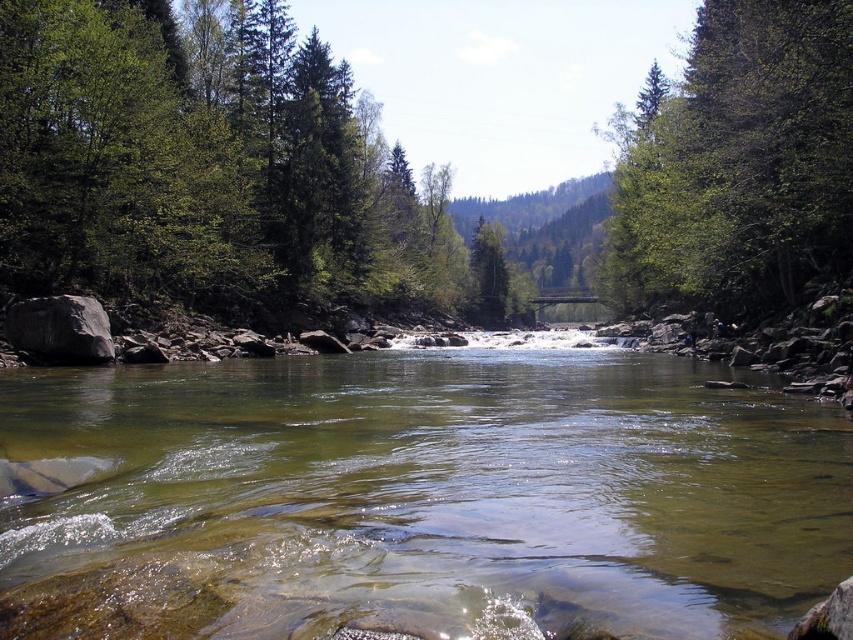
You are standing at a viewpoint overlooking the river and want to take a photo. You notice two points marked in the scene. The first point is at coordinate point (660, 260), and the second is at point (38, 356). Which point is closer to your camera position?

Point (38, 356) is closer to the camera because the description states that point (660, 260) is further away from it.

Looking at this image, you are a hiker standing at the edge of the river. You see the clear water at center and the gray smooth rock at left. Which object is closer to you?

The clear water at center is closer to you because it is in front of the gray smooth rock at left.